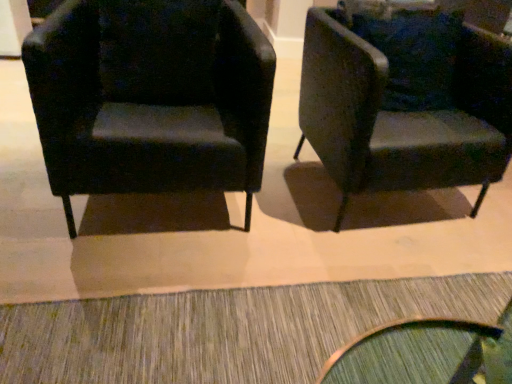
Question: Does velvet dark green armchair at right, which is the second chair from left to right, come behind matte black armchair at left, the 2th chair viewed from the right?

Choices:
 (A) yes
 (B) no

Answer: (A)

Question: Is velvet dark green armchair at right, the first chair when ordered from right to left, at the right side of matte black armchair at left, acting as the first chair starting from the left?

Choices:
 (A) yes
 (B) no

Answer: (A)

Question: Considering the relative sizes of velvet dark green armchair at right, the first chair when ordered from right to left, and matte black armchair at left, acting as the first chair starting from the left, in the image provided, is velvet dark green armchair at right, the first chair when ordered from right to left, thinner than matte black armchair at left, acting as the first chair starting from the left,?

Choices:
 (A) no
 (B) yes

Answer: (B)

Question: From a real-world perspective, is velvet dark green armchair at right, which is the second chair from left to right, located beneath matte black armchair at left, acting as the first chair starting from the left?

Choices:
 (A) no
 (B) yes

Answer: (B)

Question: Can you confirm if velvet dark green armchair at right, the first chair when ordered from right to left, is wider than matte black armchair at left, acting as the first chair starting from the left?

Choices:
 (A) yes
 (B) no

Answer: (B)

Question: From a real-world perspective, is matte black armchair at left, acting as the first chair starting from the left, above or below textured gray doormat at lower center?

Choices:
 (A) above
 (B) below

Answer: (A)

Question: Is matte black armchair at left, acting as the first chair starting from the left, in front of or behind textured gray doormat at lower center in the image?

Choices:
 (A) behind
 (B) front

Answer: (A)

Question: Is point (47, 107) positioned closer to the camera than point (26, 316)?

Choices:
 (A) farther
 (B) closer

Answer: (B)

Question: Considering the positions of matte black armchair at left, the 2th chair viewed from the right, and textured gray doormat at lower center in the image, is matte black armchair at left, the 2th chair viewed from the right, taller or shorter than textured gray doormat at lower center?

Choices:
 (A) short
 (B) tall

Answer: (B)

Question: Considering their positions, is velvet dark green armchair at right, which is the second chair from left to right, located in front of or behind textured gray doormat at lower center?

Choices:
 (A) behind
 (B) front

Answer: (A)

Question: In terms of height, does velvet dark green armchair at right, which is the second chair from left to right, look taller or shorter compared to textured gray doormat at lower center?

Choices:
 (A) short
 (B) tall

Answer: (B)

Question: Would you say velvet dark green armchair at right, the first chair when ordered from right to left, is to the left or to the right of textured gray doormat at lower center in the picture?

Choices:
 (A) left
 (B) right

Answer: (B)

Question: Is velvet dark green armchair at right, which is the second chair from left to right, inside or outside of textured gray doormat at lower center?

Choices:
 (A) outside
 (B) inside

Answer: (A)

Question: In terms of width, does textured gray doormat at lower center look wider or thinner when compared to matte black armchair at left, the 2th chair viewed from the right?

Choices:
 (A) thin
 (B) wide

Answer: (A)

Question: From the image's perspective, is textured gray doormat at lower center above or below matte black armchair at left, acting as the first chair starting from the left?

Choices:
 (A) below
 (B) above

Answer: (A)